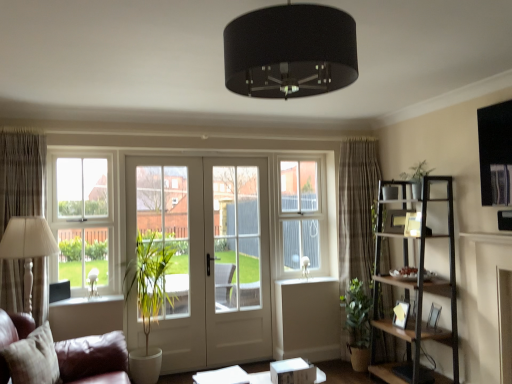
From the picture: In order to face matte wooden picture frame at upper right, arranged as the 1th picture frame when viewed from the top, should I rotate leftwards or rightwards?

You should rotate right by 19.061 degrees.

Locate an element on the screen. matte wooden picture frame at upper right, arranged as the 1th picture frame when viewed from the top is located at coordinates point(395,220).

Locate an element on the screen. Image resolution: width=512 pixels, height=384 pixels. white glass window at upper left is located at coordinates (82, 221).

Find the location of a particular element. Image resolution: width=512 pixels, height=384 pixels. white glossy window sill at center is located at coordinates (306, 281).

Considering the positions of objects white plastic window screen at center and white glass window at upper left in the image provided, who is more to the left, white plastic window screen at center or white glass window at upper left?

white glass window at upper left is more to the left.

Would you say white glass window at upper left is part of white plastic window screen at center's contents?

That's incorrect, white glass window at upper left is not inside white plastic window screen at center.

From the image's perspective, who appears lower, white plastic window screen at center or white glass window at upper left?

white glass window at upper left.

Relative to white glass window at upper left, is white plastic window screen at center in front or behind?

white plastic window screen at center is positioned farther from the viewer than white glass window at upper left.

Which object is thinner, white glossy window sill at center or black fabric lampshade at center?

With smaller width is white glossy window sill at center.

Which is closer to the camera, (302,280) or (284,98)?

Point (302,280).

Is white glossy window sill at center facing away from black fabric lampshade at center?

That's not correct — white glossy window sill at center is not looking away from black fabric lampshade at center.

Where is `lamp in front of the white glossy window sill at center`? Image resolution: width=512 pixels, height=384 pixels. lamp in front of the white glossy window sill at center is located at coordinates (290, 52).

Does matte wooden picture frame at upper right, placed as the third picture frame when sorted from bottom to top, lie in front of white paper at center?

That is False.

From the image's perspective, is matte wooden picture frame at upper right, placed as the third picture frame when sorted from bottom to top, over white paper at center?

Yes, from the image's perspective, matte wooden picture frame at upper right, placed as the third picture frame when sorted from bottom to top, is on top of white paper at center.

Is matte wooden picture frame at upper right, arranged as the 1th picture frame when viewed from the top, not inside white paper at center?

Yes, matte wooden picture frame at upper right, arranged as the 1th picture frame when viewed from the top, is located beyond the bounds of white paper at center.

Looking at this image, between matte wooden picture frame at upper right, placed as the third picture frame when sorted from bottom to top, and white paper at center, which one has larger width?

Wider between the two is white paper at center.

Between white plastic window screen at center and white glossy window sill at center, which one has more height?

white plastic window screen at center is taller.

Is white plastic window screen at center placed right next to white glossy window sill at center?

They are not placed beside each other.

Is white plastic window screen at center smaller than white glossy window sill at center?

No, white plastic window screen at center is not smaller than white glossy window sill at center.

From a real-world perspective, who is located lower, white plastic window screen at center or white glossy window sill at center?

From a 3D spatial view, white glossy window sill at center is below.

Between white wood door at center and white glass screen door at center, which one has less height?

Standing shorter between the two is white glass screen door at center.

Considering the positions of point (268, 347) and point (241, 187), is point (268, 347) closer or farther from the camera than point (241, 187)?

Clearly, point (268, 347) is more distant from the camera than point (241, 187).

From a real-world perspective, is white wood door at center physically above white glass screen door at center?

Yes, from a real-world perspective, white wood door at center is over white glass screen door at center

In the scene shown: Considering the relative positions of white wood door at center and white glass screen door at center in the image provided, is white wood door at center to the left or to the right of white glass screen door at center?

white wood door at center is positioned on white glass screen door at center's left side.

From the image's perspective, relative to beige fabric lampshade at left, is white plastic window screen at center above or below?

white plastic window screen at center is above beige fabric lampshade at left.

Looking at this image, between white plastic window screen at center and beige fabric lampshade at left, which one has larger width?

beige fabric lampshade at left is wider.

Is white plastic window screen at center looking in the opposite direction of beige fabric lampshade at left?

white plastic window screen at center does not have its back to beige fabric lampshade at left.

Is white plastic window screen at center to the right of beige fabric lampshade at left from the viewer's perspective?

Indeed, white plastic window screen at center is positioned on the right side of beige fabric lampshade at left.

Is plaid fabric curtain at right, the first curtain from the back, positioned before black fabric lampshade at center?

No, it is behind black fabric lampshade at center.

Which object is positioned more to the left, plaid fabric curtain at right, the first curtain from the back, or black fabric lampshade at center?

black fabric lampshade at center is more to the left.

Can you confirm if plaid fabric curtain at right, the first curtain from the back, is smaller than black fabric lampshade at center?

No.

Is plaid fabric curtain at right, the second curtain positioned from the left, next to black fabric lampshade at center?

No, plaid fabric curtain at right, the second curtain positioned from the left, is not touching black fabric lampshade at center.

Find the location of a particular element. The image size is (512, 384). window screen above the white glass window at upper left (from the image's perspective) is located at coordinates (300, 213).

I want to click on lamp on the left of white glossy window sill at center, so click(290, 52).

Which object lies nearer to the anchor point green matte plant at upper right, white plastic window screen at center or green leafy plant in pot at lower right?

white plastic window screen at center lies closer to green matte plant at upper right than the other object.

Estimate the real-world distances between objects in this image. Which object is further from beige fabric lampshade at left, matte wooden picture frame at upper right, arranged as the 1th picture frame when viewed from the top, or beige textured curtain at left, which appears as the 1th curtain when viewed from the left?

matte wooden picture frame at upper right, arranged as the 1th picture frame when viewed from the top, is further to beige fabric lampshade at left.

Looking at the image, which one is located further to plaid fabric curtain at right, the second curtain from the front, beige textured curtain at left, the first curtain when ordered from front to back, or white paper at center?

beige textured curtain at left, the first curtain when ordered from front to back, is positioned further to the anchor plaid fabric curtain at right, the second curtain from the front.

Looking at the image, which one is located closer to white plastic window screen at center, beige textured curtain at left, the 2th curtain viewed from the right, or black fabric lampshade at center?

Among the two, beige textured curtain at left, the 2th curtain viewed from the right, is located nearer to white plastic window screen at center.

Looking at the image, which one is located further to white paper at center, dark brown wooden shelf at right or white glass screen door at center?

Based on the image, dark brown wooden shelf at right appears to be further to white paper at center.

Considering their positions, is green leafy plant in pot at lower right positioned further to black fabric lampshade at center than white paper at center?

green leafy plant in pot at lower right is positioned further to the anchor black fabric lampshade at center.

From the image, which object appears to be nearer to green matte plant at upper right, beige fabric lampshade at left or plaid fabric curtain at right, the first curtain from the back?

Among the two, plaid fabric curtain at right, the first curtain from the back, is located nearer to green matte plant at upper right.

Which object lies further to the anchor point white glass screen door at center, green matte plant at upper right or wooden picture frame at right, the 2th picture frame positioned from the top?

The object further to white glass screen door at center is wooden picture frame at right, the 2th picture frame positioned from the top.

This screenshot has height=384, width=512. Identify the location of table between beige fabric lampshade at left and black fabric lampshade at center in the horizontal direction. click(x=222, y=376).

At what (x,y) coordinates should I click in order to perform the action: click on shelf between black fabric lampshade at center and white plastic window screen at center in the front-back direction. Please return your answer as a coordinate pair (x, y). Looking at the image, I should click on (416, 287).

Identify the location of pillow positioned between black fabric lampshade at center and plaid fabric curtain at right, positioned as the first curtain in right-to-left order, from near to far. The image size is (512, 384). (34, 358).

You are a GUI agent. You are given a task and a screenshot of the screen. Output one action in this format:
    pyautogui.click(x=<x>, y=<y>)
    Task: Click on the shelf between white wood door at center and matte wooden picture frame at upper right, arranged as the 1th picture frame when viewed from the top, from left to right
    The image size is (512, 384).
    Given the screenshot: What is the action you would take?
    pyautogui.click(x=416, y=287)